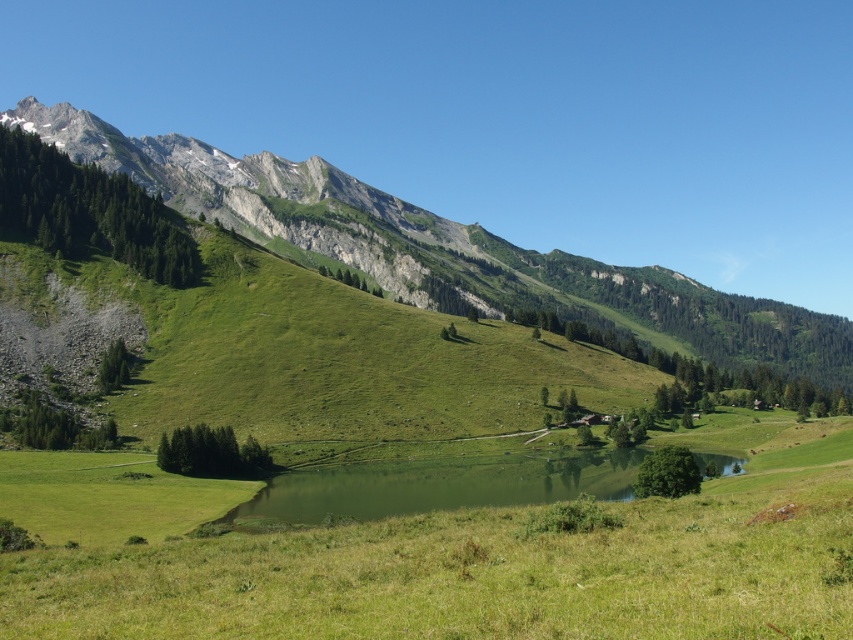
Question: Which of the following is the farthest from the observer?

Choices:
 (A) green grassy hillside at upper left
 (B) green grassy lake at center

Answer: (A)

Question: Among these points, which one is nearest to the camera?

Choices:
 (A) (289, 525)
 (B) (341, 225)

Answer: (A)

Question: Does green grassy hillside at upper left lie behind green grassy lake at center?

Choices:
 (A) no
 (B) yes

Answer: (B)

Question: Does green grassy hillside at upper left appear under green grassy lake at center?

Choices:
 (A) yes
 (B) no

Answer: (B)

Question: Is green grassy hillside at upper left behind green grassy lake at center?

Choices:
 (A) yes
 (B) no

Answer: (A)